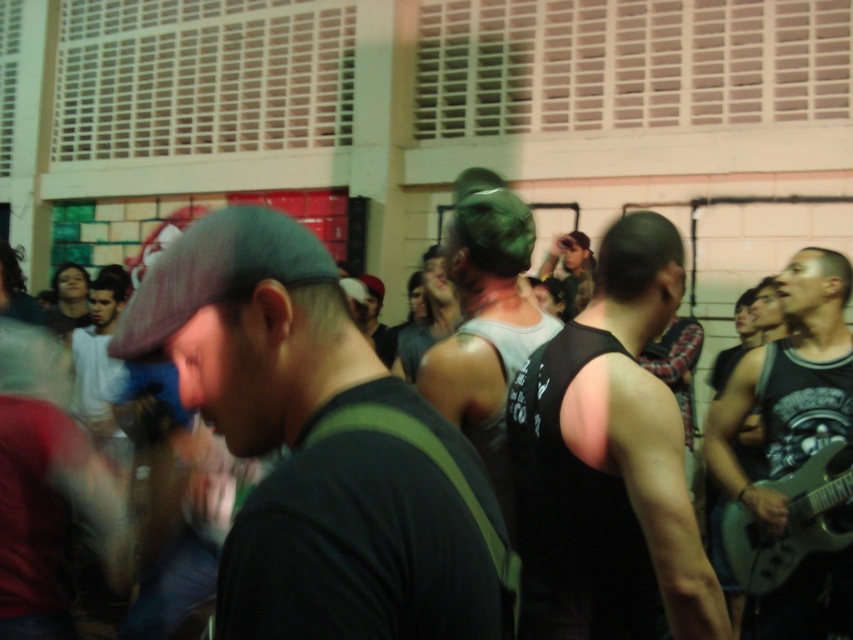
Between gray matte tank top at center and green metallic guitar at lower right, which one is positioned higher?

gray matte tank top at center is above.

Does gray matte tank top at center come behind green metallic guitar at lower right?

No.

Is point (502, 243) farther from camera compared to point (807, 541)?

No, (502, 243) is in front of (807, 541).

Find the location of a particular element. The width and height of the screenshot is (853, 640). gray matte tank top at center is located at coordinates (485, 321).

Which is more to the right, black matte tank top at center or matte green cap at center?

matte green cap at center is more to the right.

This screenshot has width=853, height=640. I want to click on black matte tank top at center, so click(x=608, y=461).

Between point (552, 589) and point (578, 253), which one is positioned in front?

Point (552, 589)

This screenshot has height=640, width=853. I want to click on black matte tank top at center, so click(x=608, y=461).

Who is higher up, black matte tank top at center or black tank top at right?

black matte tank top at center is higher up.

Does black matte tank top at center have a smaller size compared to black tank top at right?

Yes, black matte tank top at center is smaller than black tank top at right.

The height and width of the screenshot is (640, 853). What do you see at coordinates (608, 461) in the screenshot?
I see `black matte tank top at center` at bounding box center [608, 461].

What are the coordinates of `black matte tank top at center` in the screenshot? It's located at pyautogui.click(x=608, y=461).